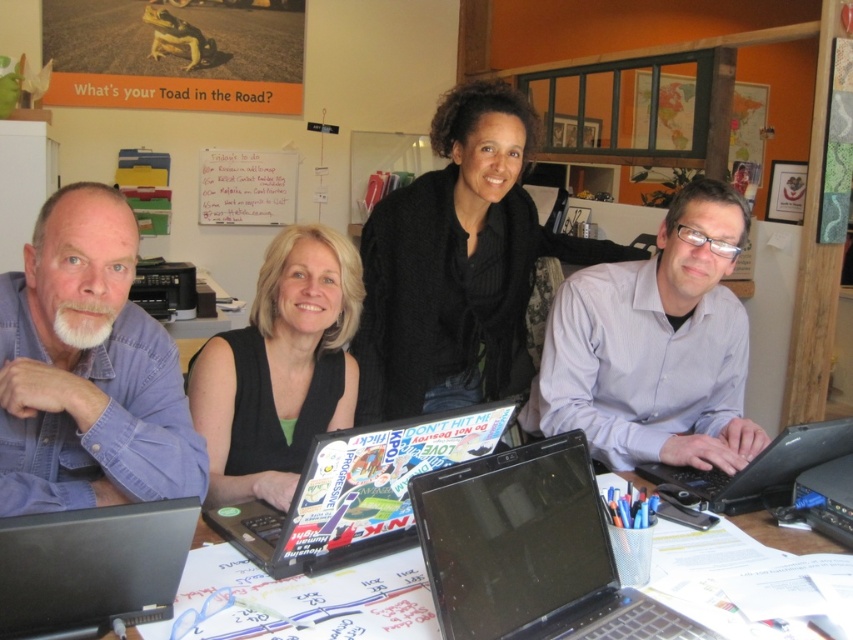
Looking at this image, you are a photographer standing behind the group and want to take a photo of the white paper at center without including the purple shirt at right in the frame. Is this possible based on their current positions?

The purple shirt at right is further to the viewer than white paper at center, so the photographer cannot take a photo of the white paper at center without including the purple shirt at right in the frame because the purple shirt is closer and blocking the view.

You are a delivery robot with a 20 inch wide package that needs to place on the table. The table has the black glossy laptop at center. Can you place the package on the table without moving the laptop?

The black glossy laptop at center is 37.80 inches away from the camera. Since the package is only 20 inches wide, there is enough space to place it on the table without moving the laptop.